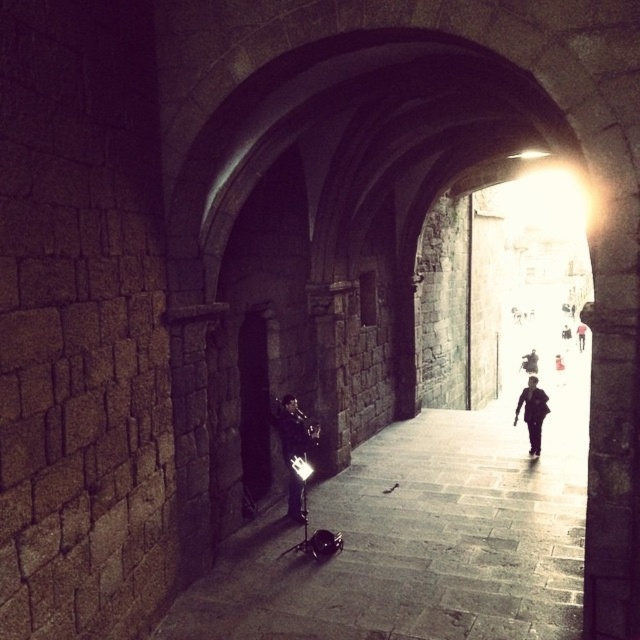
Question: Which point is farther to the camera?

Choices:
 (A) shiny black jacket at lower center
 (B) black matte jacket at center

Answer: (B)

Question: Which point is closer to the camera?

Choices:
 (A) dark blue jeans at right
 (B) shiny black jacket at lower center
 (C) black matte jacket at center

Answer: (B)

Question: Which of the following is the closest to the observer?

Choices:
 (A) black matte jacket at center
 (B) dark blue jeans at right
 (C) shiny black jacket at lower center
 (D) dark gray suit at center

Answer: (C)

Question: Does shiny black jacket at lower center appear under black matte jacket at center?

Choices:
 (A) no
 (B) yes

Answer: (A)

Question: Can you confirm if black matte jacket at center is bigger than dark blue jeans at right?

Choices:
 (A) no
 (B) yes

Answer: (B)

Question: In this image, where is black matte jacket at center located relative to dark gray suit at center?

Choices:
 (A) above
 (B) below

Answer: (B)